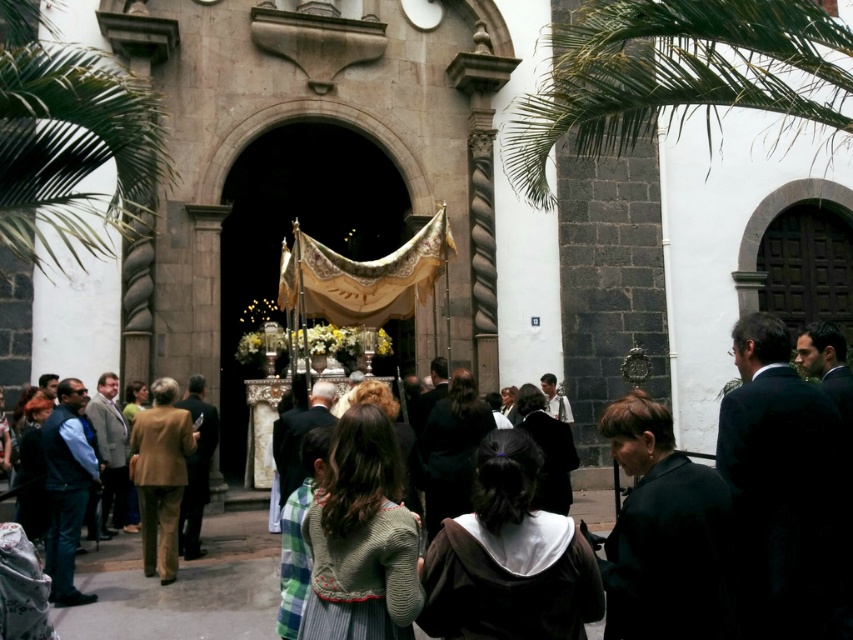
Question: Which object appears farthest from the camera in this image?

Choices:
 (A) knitted sweater at center
 (B) green leafy palm tree at left
 (C) dark brown hoodie at center
 (D) black matte jacket at lower right

Answer: (B)

Question: Is black matte jacket at lower right wider than brown fabric jacket at center?

Choices:
 (A) yes
 (B) no

Answer: (A)

Question: Which point appears closest to the camera in this image?

Choices:
 (A) (706, 589)
 (B) (33, 136)
 (C) (386, 545)

Answer: (C)

Question: Among these points, which one is nearest to the camera?

Choices:
 (A) (828, 13)
 (B) (665, 602)

Answer: (B)

Question: Can you confirm if green leafy palm tree at upper right is positioned below dark brown hoodie at center?

Choices:
 (A) no
 (B) yes

Answer: (A)

Question: From the image, what is the correct spatial relationship of green leafy palm tree at upper right in relation to brown fabric jacket at center?

Choices:
 (A) right
 (B) left

Answer: (A)